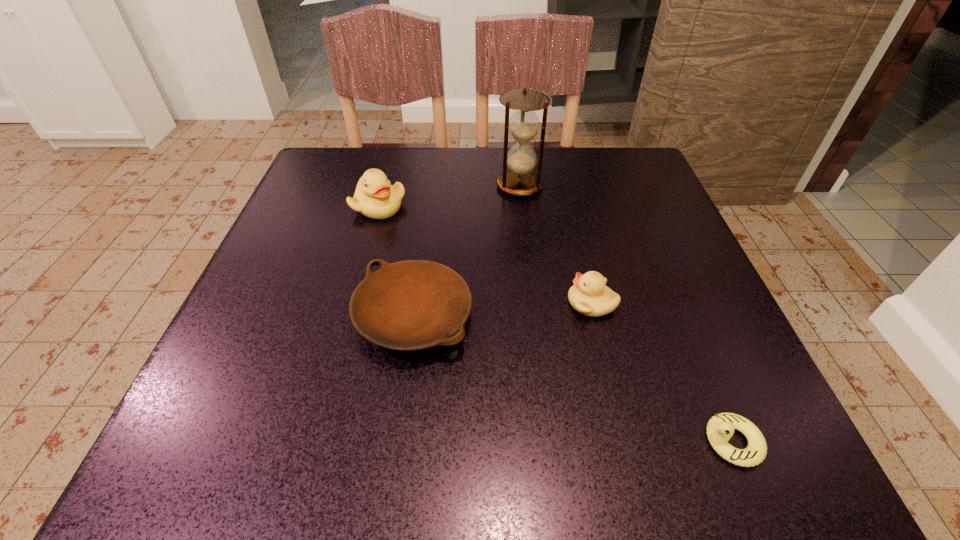
You are a GUI agent. You are given a task and a screenshot of the screen. Output one action in this format:
    pyautogui.click(x=<x>, y=<y>)
    Task: Click on the vacant space that is in between the plate and the farthest duckling
    This screenshot has width=960, height=540.
    Given the screenshot: What is the action you would take?
    pyautogui.click(x=396, y=261)

The width and height of the screenshot is (960, 540). What are the coordinates of `vacant space that is in between the leftmost duckling and the rightmost duckling` in the screenshot? It's located at (555, 324).

At what (x,y) coordinates should I click in order to perform the action: click on vacant area between the nearest duckling and the third object from right to left. Please return your answer as a coordinate pair (x, y). Looking at the image, I should click on (625, 314).

The width and height of the screenshot is (960, 540). Find the location of `vacant space in between the tallest object and the second object from right to left`. vacant space in between the tallest object and the second object from right to left is located at coordinates (556, 245).

You are a GUI agent. You are given a task and a screenshot of the screen. Output one action in this format:
    pyautogui.click(x=<x>, y=<y>)
    Task: Click on the free space between the hourglass and the second tallest object
    
    Given the screenshot: What is the action you would take?
    pyautogui.click(x=449, y=196)

At what (x,y) coordinates should I click in order to perform the action: click on vacant area that lies between the third object from left to right and the farthest duckling. Please return your answer as a coordinate pair (x, y). This screenshot has width=960, height=540. Looking at the image, I should click on (449, 196).

Where is `free space between the nearest duckling and the plate`? The image size is (960, 540). free space between the nearest duckling and the plate is located at coordinates (572, 379).

Find the location of `free area in between the farthest duckling and the plate`. free area in between the farthest duckling and the plate is located at coordinates click(396, 261).

This screenshot has width=960, height=540. Identify the location of vacant region between the nearest object and the tallest object. (625, 314).

Where is `free point between the plate and the shortest duckling`? free point between the plate and the shortest duckling is located at coordinates (572, 379).